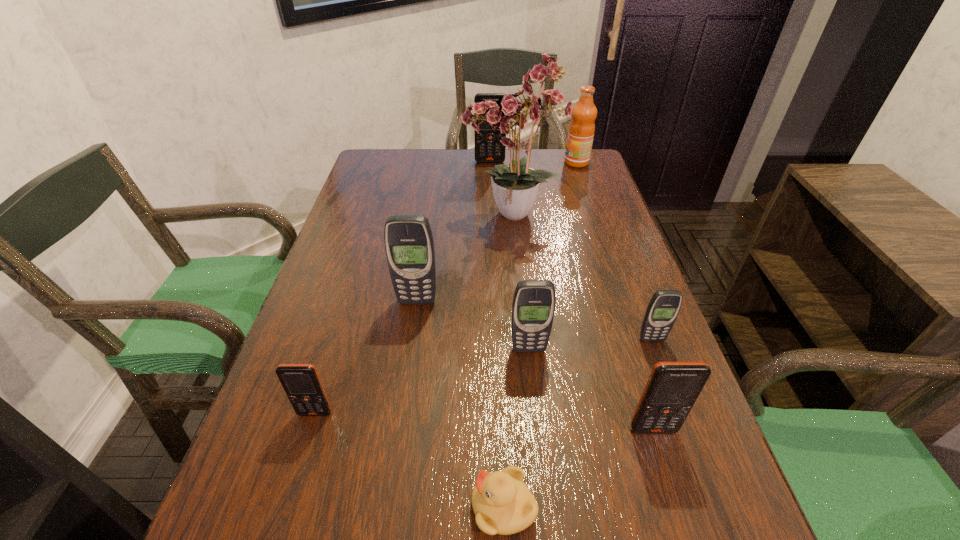
At what (x,y) coordinates should I click in order to perform the action: click on free region located 0.150m on the label side of the fruit juice. Please return your answer as a coordinate pair (x, y). This screenshot has height=540, width=960. Looking at the image, I should click on click(x=519, y=163).

This screenshot has height=540, width=960. I want to click on vacant space located 0.290m on the screen of the farthest orange cellular telephone, so click(492, 213).

I want to click on free point located on the screen of the biggest gray cellular telephone, so click(x=396, y=442).

Where is `free space located on the screen of the fourth farthest cellular telephone`? free space located on the screen of the fourth farthest cellular telephone is located at coordinates (535, 401).

Where is `free space located 0.130m on the screen of the rightmost orange cellular telephone`? The width and height of the screenshot is (960, 540). free space located 0.130m on the screen of the rightmost orange cellular telephone is located at coordinates (681, 517).

Where is `vacant space located on the screen of the fifth farthest cellular telephone`? This screenshot has width=960, height=540. vacant space located on the screen of the fifth farthest cellular telephone is located at coordinates (303, 450).

I want to click on vacant space situated 0.050m on the screen of the third farthest cellular telephone, so click(660, 362).

I want to click on fruit juice that is positioned at the far edge, so click(x=580, y=136).

Identify the location of cellular telephone located in the far edge section of the desktop. The height and width of the screenshot is (540, 960). (485, 147).

The image size is (960, 540). Identify the location of object that is at the left edge. (301, 382).